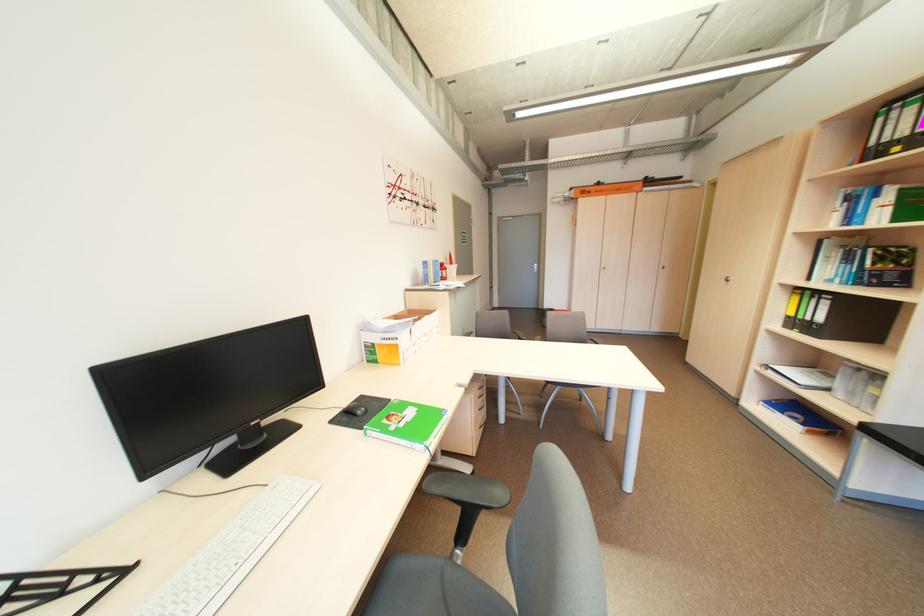
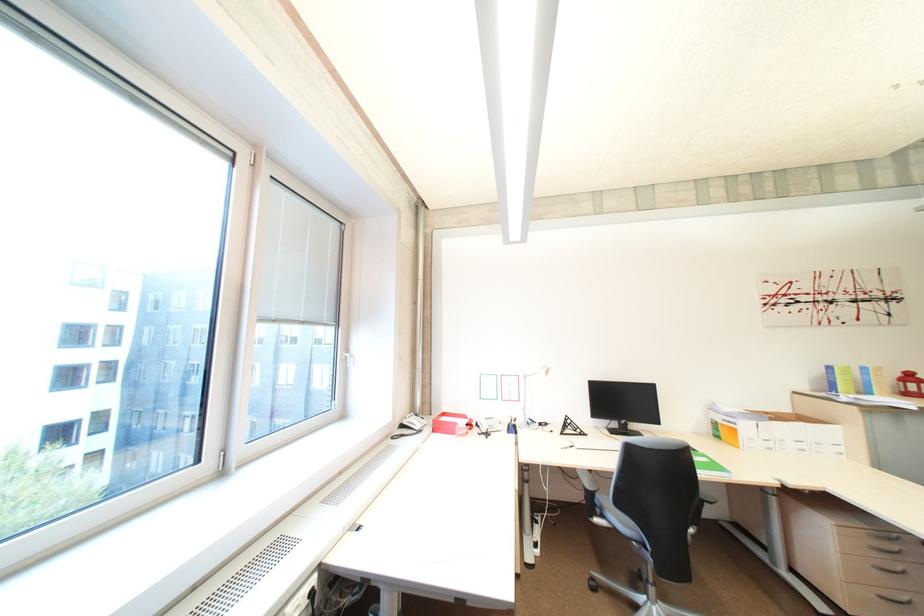
The point at (x=406, y=347) is marked in the first image. Where is the corresponding point in the second image?

(745, 431)